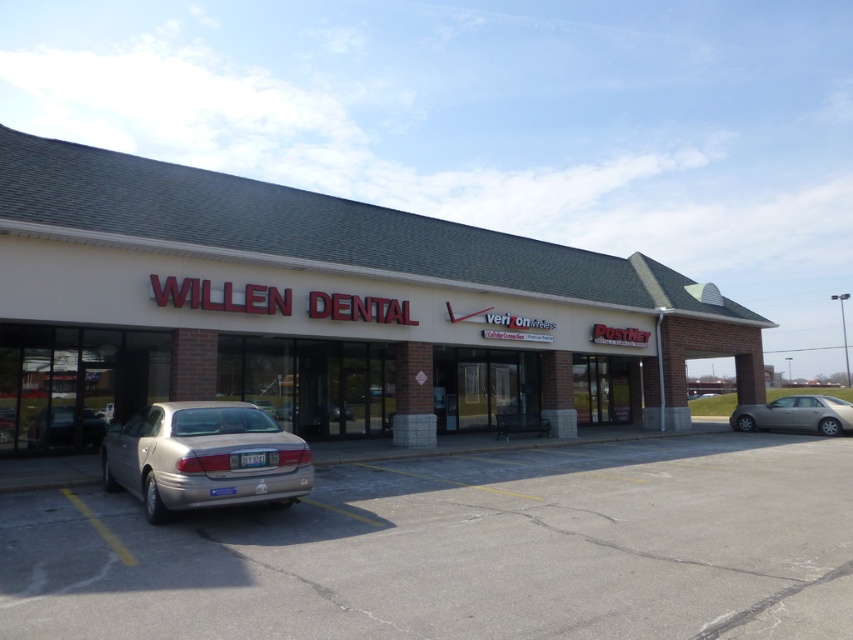
You are standing at the entrance of the PostNet store and want to park your car in the closest available spot. There is a silver metallic car at lower left. Based on its position, can you estimate whether the parking spot nearest to the PostNet store is occupied?

The silver metallic car at lower left is located at point (463, 548), which suggests it is parked near the PostNet store. Therefore, the parking spot nearest to the PostNet store is likely occupied by the silver metallic car at lower left.

You are a delivery person trying to park a van that is 2 meters wide. You see a satin gold sedan at lower left and a silver metallic sedan at lower left. Can you determine if there is enough space between them to park your van?

The satin gold sedan at lower left might be wider than the silver metallic sedan at lower left, so there is uncertainty about whether the space between them is wide enough for a 2 meter wide van. Check the actual width of both sedans before deciding.

You are a pedestrian standing at the entrance of the PostNet store. You see a silver metallic car at lower left and a silver metallic sedan at lower left. Which vehicle is closer to you?

The silver metallic car at lower left is closer to you because it is in front of the silver metallic sedan at lower left.